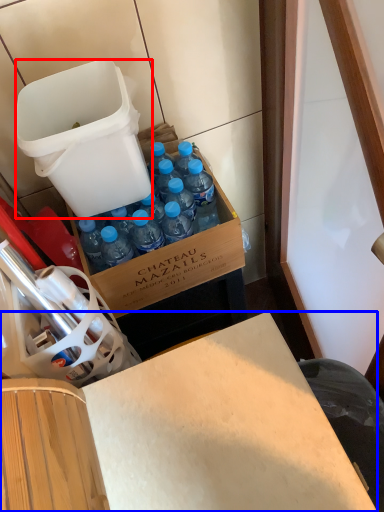
Question: Which of the following is the closest to the observer, trash bin/can (highlighted by a red box) or desk (highlighted by a blue box)?

Choices:
 (A) trash bin/can
 (B) desk

Answer: (B)